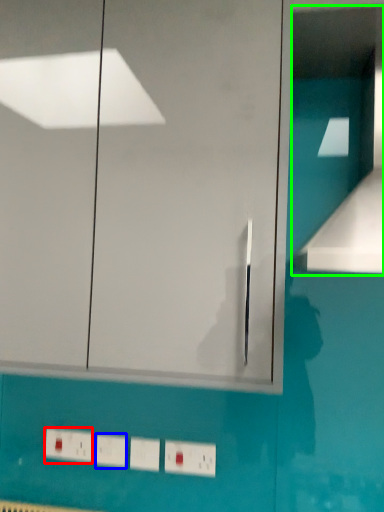
Question: Which is farther away from electric outlet (highlighted by a red box)? light switch (highlighted by a blue box) or vent (highlighted by a green box)?

Choices:
 (A) light switch
 (B) vent

Answer: (B)